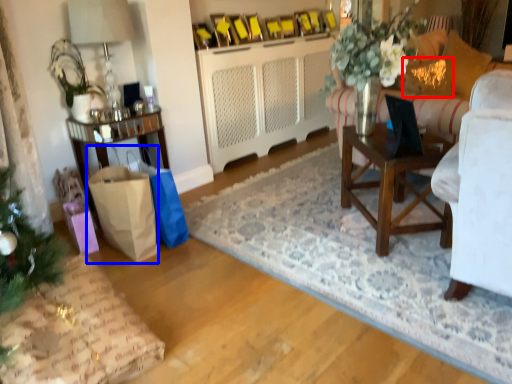
Question: Among these objects, which one is farthest to the camera, pillow (highlighted by a red box) or shopping bag (highlighted by a blue box)?

Choices:
 (A) pillow
 (B) shopping bag

Answer: (A)